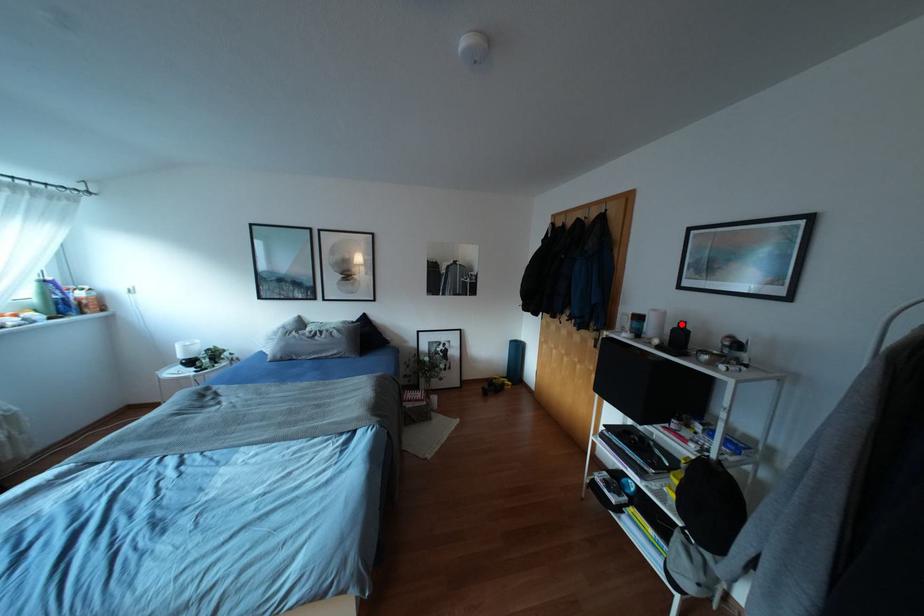
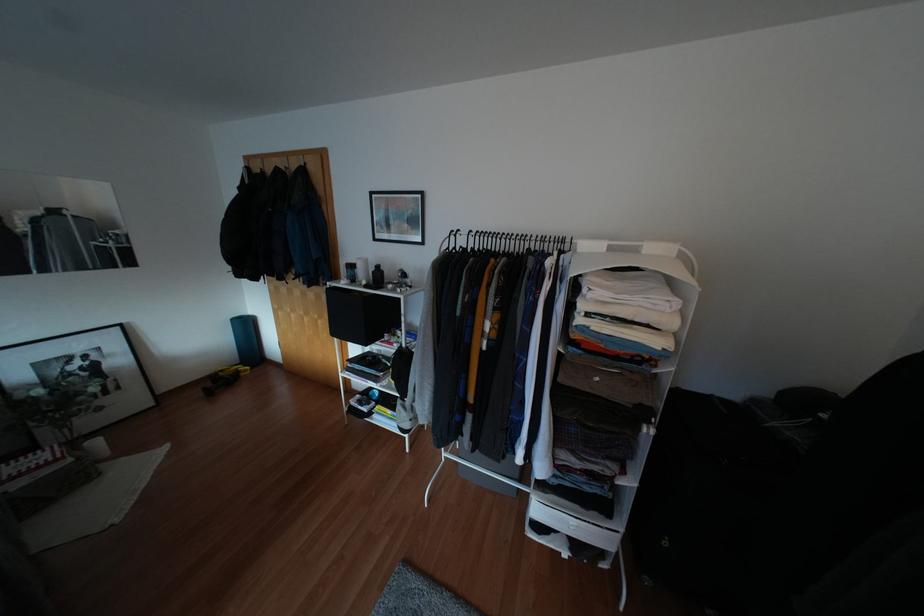
Question: I am providing you with two images of the same scene from different viewpoints. A red point is marked on the first image. Can you still see the location of the red point in image 2?

Choices:
 (A) Yes
 (B) No

Answer: (A)